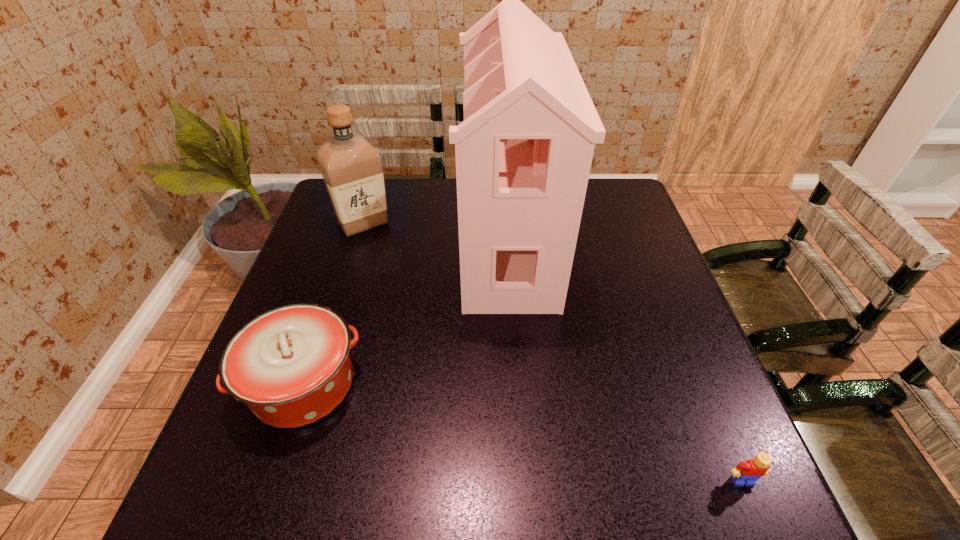
The width and height of the screenshot is (960, 540). Find the location of `vacant space at the far edge of the desktop`. vacant space at the far edge of the desktop is located at coordinates (418, 181).

Find the location of a particular element. vacant space at the right edge of the desktop is located at coordinates (659, 294).

Where is `free space at the far right corner of the desktop`? The width and height of the screenshot is (960, 540). free space at the far right corner of the desktop is located at coordinates (619, 188).

The height and width of the screenshot is (540, 960). Find the location of `blank region between the shortest object and the third shortest object`. blank region between the shortest object and the third shortest object is located at coordinates (553, 352).

Image resolution: width=960 pixels, height=540 pixels. In order to click on free point between the tallest object and the casserole in this screenshot , I will do `click(406, 312)`.

The image size is (960, 540). Identify the location of vacant area that lies between the second tallest object and the third tallest object. (333, 303).

You are a GUI agent. You are given a task and a screenshot of the screen. Output one action in this format:
    pyautogui.click(x=<x>, y=<y>)
    Task: Click on the vacant space that is in between the casserole and the nearest object
    
    Given the screenshot: What is the action you would take?
    pyautogui.click(x=523, y=433)

You are a GUI agent. You are given a task and a screenshot of the screen. Output one action in this format:
    pyautogui.click(x=<x>, y=<y>)
    Task: Click on the blank region between the second object from right to left and the third shortest object
    The width and height of the screenshot is (960, 540).
    Given the screenshot: What is the action you would take?
    point(436,232)

Where is `unoccupied position between the dollhouse and the third tallest object`? unoccupied position between the dollhouse and the third tallest object is located at coordinates click(x=406, y=312).

The width and height of the screenshot is (960, 540). In order to click on empty space between the nearest object and the dollhouse in this screenshot , I will do coord(625,361).